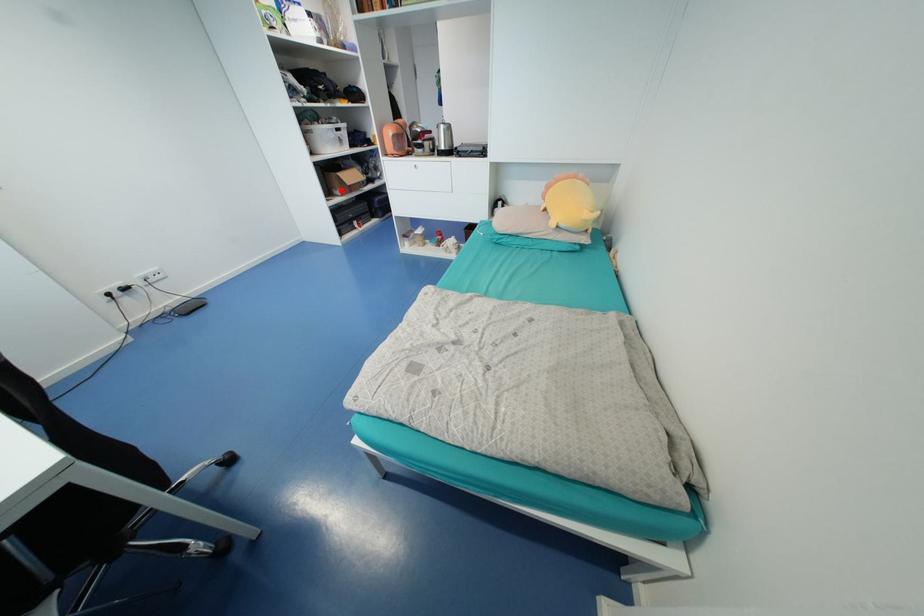
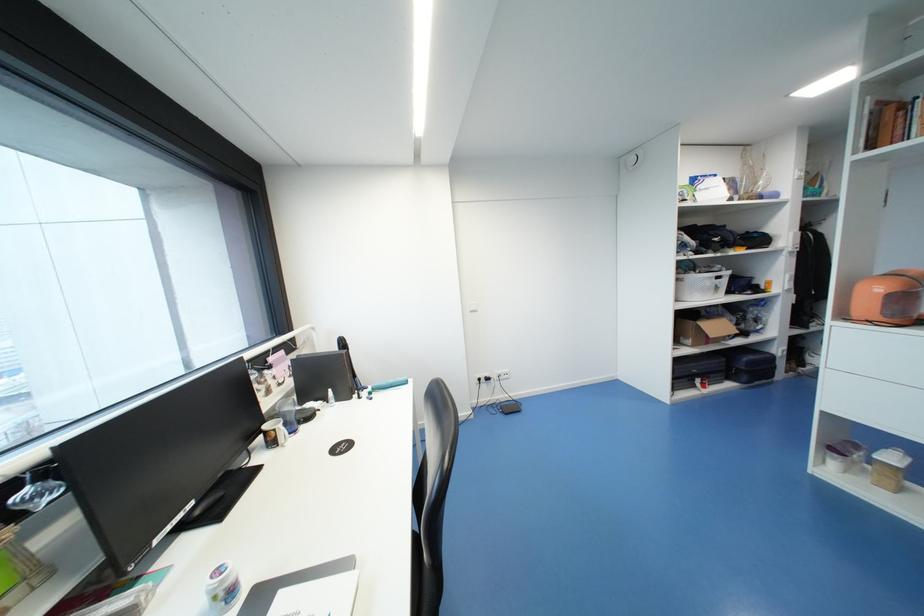
Question: I am providing you with two images of the same scene from different viewpoints. Image1 has a red point marked. In image2, the corresponding 3D location appears at what relative position? Reply with the corresponding letter.

Choices:
 (A) Closer
 (B) Farther

Answer: (B)